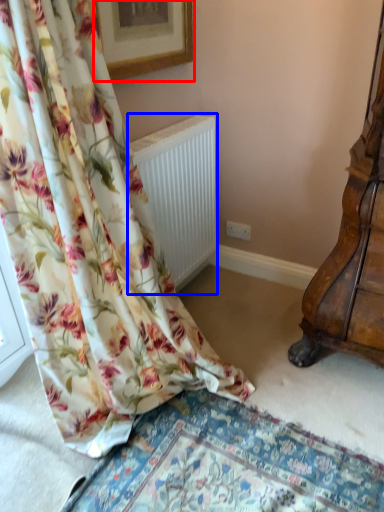
Question: Which point is closer to the camera, picture frame (highlighted by a red box) or radiator (highlighted by a blue box)?

Choices:
 (A) picture frame
 (B) radiator

Answer: (A)